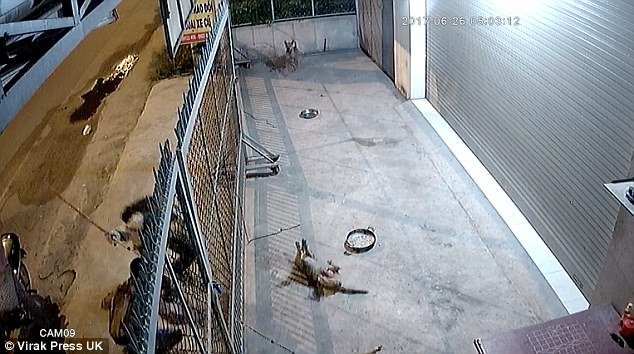
Where is `concrete wall`? Image resolution: width=634 pixels, height=354 pixels. concrete wall is located at coordinates (314, 33).